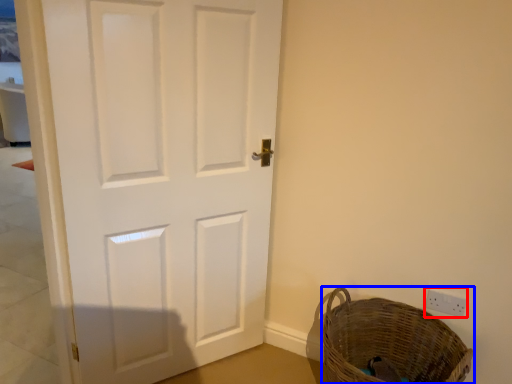
Question: Which object appears closest to the camera in this image, electric outlet (highlighted by a red box) or basket (highlighted by a blue box)?

Choices:
 (A) electric outlet
 (B) basket

Answer: (B)